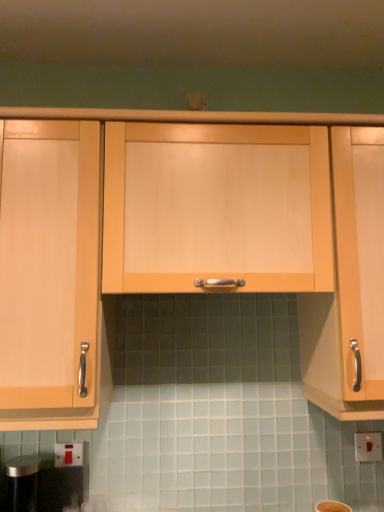
Image resolution: width=384 pixels, height=512 pixels. Identify the location of metallic cylindrical container at lower left. (41, 485).

I want to click on light wood cabinet at left, the 1th cabinetry when ordered from left to right, so click(51, 274).

Identify the location of light wood cabinet handle at right, the 1th cabinetry in the right-to-left sequence. (350, 285).

The height and width of the screenshot is (512, 384). Describe the element at coordinates (69, 454) in the screenshot. I see `matte white electric outlet at lower left, which is the 1th electric outlet in left-to-right order` at that location.

You are a GUI agent. You are given a task and a screenshot of the screen. Output one action in this format:
    pyautogui.click(x=<x>, y=<y>)
    Task: Click on the metallic cylindrical container at lower left
    The width and height of the screenshot is (384, 512).
    Given the screenshot: What is the action you would take?
    pyautogui.click(x=41, y=485)

Which object is more forward, white plastic switch at lower right, positioned as the 1th electric outlet in back-to-front order, or light wood cabinet at center, placed as the 2th cabinetry when sorted from left to right?

light wood cabinet at center, placed as the 2th cabinetry when sorted from left to right, is more forward.

In terms of size, does white plastic switch at lower right, the 2th electric outlet in the front-to-back sequence, appear bigger or smaller than light wood cabinet at center, placed as the 2th cabinetry when sorted from left to right?

Clearly, white plastic switch at lower right, the 2th electric outlet in the front-to-back sequence, is smaller in size than light wood cabinet at center, placed as the 2th cabinetry when sorted from left to right.

From the image's perspective, is white plastic switch at lower right, which is the second electric outlet in left-to-right order, located above or below light wood cabinet at center, placed as the 2th cabinetry when sorted from left to right?

white plastic switch at lower right, which is the second electric outlet in left-to-right order, is situated lower than light wood cabinet at center, placed as the 2th cabinetry when sorted from left to right, in the image.

Considering the positions of point (6, 492) and point (240, 260), is point (6, 492) closer or farther from the camera than point (240, 260)?

Point (6, 492).

From the image's perspective, starting from the metallic cylindrical container at lower left, which cabinetry is the 3rd one above? Please provide its 2D coordinates.

[(216, 207)]

From a real-world perspective, which is physically above, metallic cylindrical container at lower left or light wood cabinet at center, which ranks as the second cabinetry in right-to-left order?

light wood cabinet at center, which ranks as the second cabinetry in right-to-left order, is physically above.

Is metallic cylindrical container at lower left at the left side of light wood cabinet at center, placed as the 2th cabinetry when sorted from left to right?

Correct, you'll find metallic cylindrical container at lower left to the left of light wood cabinet at center, placed as the 2th cabinetry when sorted from left to right.

From the image's perspective, is matte white electric outlet at lower left, which is the 1th electric outlet in left-to-right order, located beneath light wood cabinet at left, which appears as the 3th cabinetry when viewed from the right?

Indeed, from the image's perspective, matte white electric outlet at lower left, which is the 1th electric outlet in left-to-right order, is shown beneath light wood cabinet at left, which appears as the 3th cabinetry when viewed from the right.

From a real-world perspective, count 1st cabinetrys upward from the matte white electric outlet at lower left, which is the 1th electric outlet in left-to-right order, and point to it. Please provide its 2D coordinates.

[(51, 274)]

Which is correct: matte white electric outlet at lower left, placed as the second electric outlet when sorted from right to left, is inside light wood cabinet at left, the 1th cabinetry when ordered from left to right, or outside of it?

matte white electric outlet at lower left, placed as the second electric outlet when sorted from right to left, is not enclosed by light wood cabinet at left, the 1th cabinetry when ordered from left to right.

Does matte white electric outlet at lower left, placed as the second electric outlet when sorted from right to left, come in front of light wood cabinet at left, which appears as the 3th cabinetry when viewed from the right?

No, matte white electric outlet at lower left, placed as the second electric outlet when sorted from right to left, is behind light wood cabinet at left, which appears as the 3th cabinetry when viewed from the right.

Where is `appliance below the light wood cabinet at center, which ranks as the second cabinetry in right-to-left order (from a real-world perspective)`? The image size is (384, 512). appliance below the light wood cabinet at center, which ranks as the second cabinetry in right-to-left order (from a real-world perspective) is located at coordinates (41, 485).

From the image's perspective, who appears lower, light wood cabinet at center, which ranks as the second cabinetry in right-to-left order, or metallic cylindrical container at lower left?

metallic cylindrical container at lower left appears lower in the image.

Looking at this image, which point is more forward, [252,205] or [28,474]?

Point [252,205]

How much distance is there between light wood cabinet at center, which ranks as the second cabinetry in right-to-left order, and metallic cylindrical container at lower left?

The distance of light wood cabinet at center, which ranks as the second cabinetry in right-to-left order, from metallic cylindrical container at lower left is 32.66 inches.

Considering the relative positions of matte white electric outlet at lower left, placed as the second electric outlet when sorted from right to left, and white plastic switch at lower right, arranged as the 1th electric outlet when viewed from the right, in the image provided, is matte white electric outlet at lower left, placed as the second electric outlet when sorted from right to left, behind white plastic switch at lower right, arranged as the 1th electric outlet when viewed from the right,?

No.

Is matte white electric outlet at lower left, placed as the second electric outlet when sorted from right to left, next to white plastic switch at lower right, the 2th electric outlet in the front-to-back sequence?

matte white electric outlet at lower left, placed as the second electric outlet when sorted from right to left, and white plastic switch at lower right, the 2th electric outlet in the front-to-back sequence, are clearly separated.

Considering the sizes of objects matte white electric outlet at lower left, which is the 1th electric outlet in left-to-right order, and white plastic switch at lower right, which is the second electric outlet in left-to-right order, in the image provided, who is taller, matte white electric outlet at lower left, which is the 1th electric outlet in left-to-right order, or white plastic switch at lower right, which is the second electric outlet in left-to-right order,?

With more height is white plastic switch at lower right, which is the second electric outlet in left-to-right order.

Which of these two, light wood cabinet at center, which ranks as the second cabinetry in right-to-left order, or light wood cabinet at left, which appears as the 3th cabinetry when viewed from the right, is bigger?

With larger size is light wood cabinet at left, which appears as the 3th cabinetry when viewed from the right.

From a real-world perspective, starting from the light wood cabinet at center, which ranks as the second cabinetry in right-to-left order, which cabinetry is the 2nd one below it? Please provide its 2D coordinates.

[(51, 274)]

Does point (195, 263) lie behind point (15, 128)?

No, (195, 263) is in front of (15, 128).

Which object is wider, light wood cabinet at center, placed as the 2th cabinetry when sorted from left to right, or light wood cabinet at left, the 1th cabinetry when ordered from left to right?

light wood cabinet at left, the 1th cabinetry when ordered from left to right, is wider.

Is matte white electric outlet at lower left, which is the second electric outlet from back to front, smaller than light wood cabinet handle at right, the 1th cabinetry in the right-to-left sequence?

Indeed, matte white electric outlet at lower left, which is the second electric outlet from back to front, has a smaller size compared to light wood cabinet handle at right, the 1th cabinetry in the right-to-left sequence.

Between matte white electric outlet at lower left, which is the second electric outlet from back to front, and light wood cabinet handle at right, the 1th cabinetry in the right-to-left sequence, which one appears on the right side from the viewer's perspective?

From the viewer's perspective, light wood cabinet handle at right, the 1th cabinetry in the right-to-left sequence, appears more on the right side.

Measure the distance between matte white electric outlet at lower left, the first electric outlet in the front-to-back sequence, and light wood cabinet handle at right, the 1th cabinetry in the right-to-left sequence.

matte white electric outlet at lower left, the first electric outlet in the front-to-back sequence, and light wood cabinet handle at right, the 1th cabinetry in the right-to-left sequence, are 36.58 inches apart from each other.

From a real-world perspective, is matte white electric outlet at lower left, which is the second electric outlet from back to front, positioned over light wood cabinet handle at right, the 1th cabinetry in the right-to-left sequence, based on gravity?

No, from a real-world perspective, matte white electric outlet at lower left, which is the second electric outlet from back to front, is not over light wood cabinet handle at right, the 1th cabinetry in the right-to-left sequence

Where is `the 2nd cabinetry to the left when counting from the white plastic switch at lower right, which is the second electric outlet in left-to-right order`? Image resolution: width=384 pixels, height=512 pixels. the 2nd cabinetry to the left when counting from the white plastic switch at lower right, which is the second electric outlet in left-to-right order is located at coordinates (216, 207).

Identify the location of appliance below the light wood cabinet at center, placed as the 2th cabinetry when sorted from left to right (from a real-world perspective). (41, 485).

Based on their spatial positions, is light wood cabinet at left, which appears as the 3th cabinetry when viewed from the right, or matte white electric outlet at lower left, the first electric outlet in the front-to-back sequence, further from light wood cabinet handle at right, the 1th cabinetry in the right-to-left sequence?

matte white electric outlet at lower left, the first electric outlet in the front-to-back sequence, is positioned further to the anchor light wood cabinet handle at right, the 1th cabinetry in the right-to-left sequence.

From the image, which object appears to be nearer to metallic cylindrical container at lower left, matte white electric outlet at lower left, which is the second electric outlet from back to front, or light wood cabinet handle at right, arranged as the 3th cabinetry when viewed from the left?

matte white electric outlet at lower left, which is the second electric outlet from back to front, lies closer to metallic cylindrical container at lower left than the other object.

Based on their spatial positions, is light wood cabinet at left, the 1th cabinetry when ordered from left to right, or metallic cylindrical container at lower left further from matte white electric outlet at lower left, placed as the second electric outlet when sorted from right to left?

The object further to matte white electric outlet at lower left, placed as the second electric outlet when sorted from right to left, is light wood cabinet at left, the 1th cabinetry when ordered from left to right.

Which object lies further to the anchor point light wood cabinet handle at right, arranged as the 3th cabinetry when viewed from the left, light wood cabinet at left, the 1th cabinetry when ordered from left to right, or white plastic switch at lower right, which is the second electric outlet in left-to-right order?

The object further to light wood cabinet handle at right, arranged as the 3th cabinetry when viewed from the left, is light wood cabinet at left, the 1th cabinetry when ordered from left to right.

Looking at the image, which one is located further to light wood cabinet handle at right, arranged as the 3th cabinetry when viewed from the left, light wood cabinet at left, the 1th cabinetry when ordered from left to right, or metallic cylindrical container at lower left?

metallic cylindrical container at lower left is further to light wood cabinet handle at right, arranged as the 3th cabinetry when viewed from the left.

Based on their spatial positions, is metallic cylindrical container at lower left or white plastic switch at lower right, the 2th electric outlet in the front-to-back sequence, further from matte white electric outlet at lower left, the first electric outlet in the front-to-back sequence?

white plastic switch at lower right, the 2th electric outlet in the front-to-back sequence.

From the image, which object appears to be nearer to white plastic switch at lower right, which is the second electric outlet in left-to-right order, light wood cabinet at center, placed as the 2th cabinetry when sorted from left to right, or light wood cabinet handle at right, arranged as the 3th cabinetry when viewed from the left?

light wood cabinet handle at right, arranged as the 3th cabinetry when viewed from the left, is closer to white plastic switch at lower right, which is the second electric outlet in left-to-right order.

Based on their spatial positions, is light wood cabinet handle at right, the 1th cabinetry in the right-to-left sequence, or light wood cabinet at left, which appears as the 3th cabinetry when viewed from the right, further from matte white electric outlet at lower left, placed as the second electric outlet when sorted from right to left?

Among the two, light wood cabinet handle at right, the 1th cabinetry in the right-to-left sequence, is located further to matte white electric outlet at lower left, placed as the second electric outlet when sorted from right to left.

The image size is (384, 512). I want to click on cabinetry between matte white electric outlet at lower left, which is the 1th electric outlet in left-to-right order, and light wood cabinet handle at right, arranged as the 3th cabinetry when viewed from the left, from left to right, so click(x=216, y=207).

You are a GUI agent. You are given a task and a screenshot of the screen. Output one action in this format:
    pyautogui.click(x=<x>, y=<y>)
    Task: Click on the electric outlet between light wood cabinet at left, which appears as the 3th cabinetry when viewed from the right, and white plastic switch at lower right, the 2th electric outlet in the front-to-back sequence
    This screenshot has height=512, width=384.
    Given the screenshot: What is the action you would take?
    pyautogui.click(x=69, y=454)

Where is `electric outlet between metallic cylindrical container at lower left and white plastic switch at lower right, the 2th electric outlet in the front-to-back sequence, in the horizontal direction`? The image size is (384, 512). electric outlet between metallic cylindrical container at lower left and white plastic switch at lower right, the 2th electric outlet in the front-to-back sequence, in the horizontal direction is located at coordinates (69, 454).

Where is `cabinetry between light wood cabinet at left, the 1th cabinetry when ordered from left to right, and light wood cabinet handle at right, the 1th cabinetry in the right-to-left sequence`? cabinetry between light wood cabinet at left, the 1th cabinetry when ordered from left to right, and light wood cabinet handle at right, the 1th cabinetry in the right-to-left sequence is located at coordinates (216, 207).